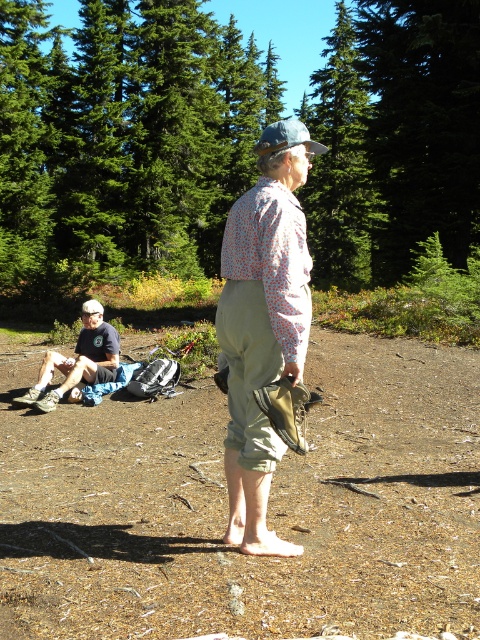
Question: Which object appears farthest from the camera in this image?

Choices:
 (A) green textured tree at upper center
 (B) dark blue fabric shirt at lower left
 (C) green leafy tree at upper center

Answer: (A)

Question: Does green textured tree at center have a greater width compared to green leafy tree at upper center?

Choices:
 (A) no
 (B) yes

Answer: (B)

Question: Is khakimaterial/texturepants at center positioned before green textured tree at upper center?

Choices:
 (A) no
 (B) yes

Answer: (B)

Question: Which object is the farthest from the green leafy tree at upper center?

Choices:
 (A) dark blue fabric shirt at lower left
 (B) khakimaterial/texturepants at center
 (C) green textured tree at upper center
 (D) green textured tree at center

Answer: (B)

Question: Estimate the real-world distances between objects in this image. Which object is closer to the green textured tree at center?

Choices:
 (A) green leafy tree at upper center
 (B) dark blue fabric shirt at lower left

Answer: (A)

Question: Is green textured tree at center bigger than khakimaterial/texturepants at center?

Choices:
 (A) no
 (B) yes

Answer: (B)